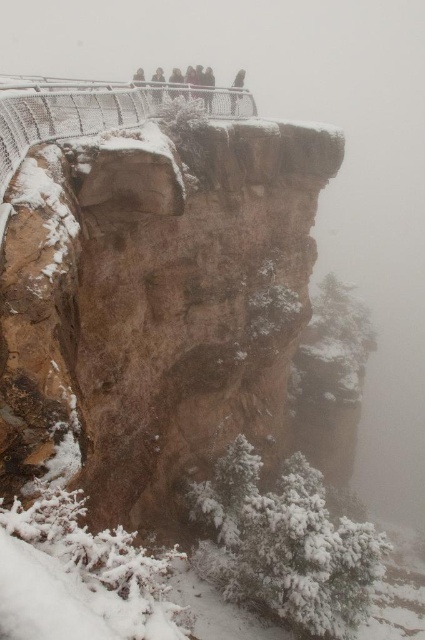
Who is more distant from viewer, (159, 106) or (240, 83)?

The point (240, 83) is more distant.

Is metal wire fence at upper center wider than dark gray stone figure at upper center?

Correct, the width of metal wire fence at upper center exceeds that of dark gray stone figure at upper center.

I want to click on metal wire fence at upper center, so click(x=90, y=109).